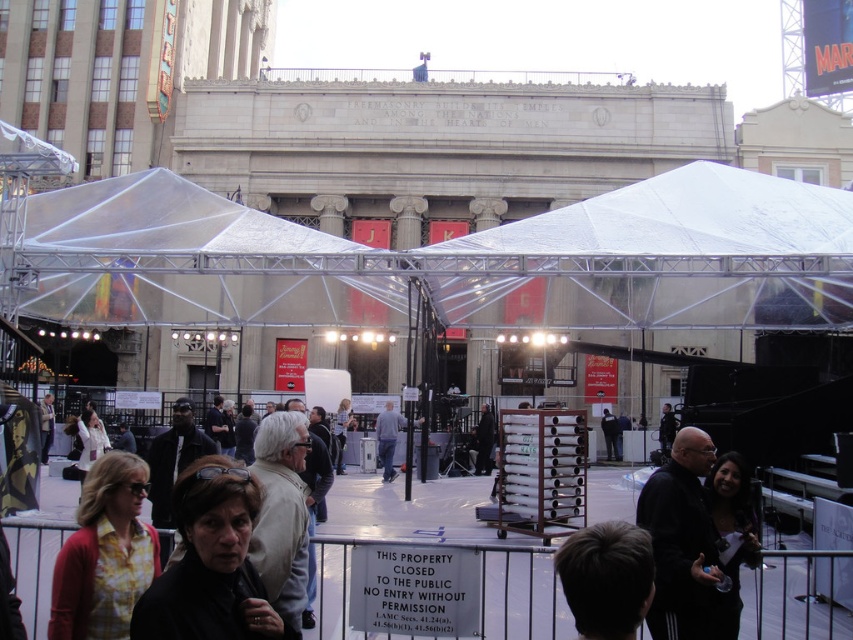
Can you confirm if dark brown hair at center is smaller than black leather jacket at center?

Incorrect, dark brown hair at center is not smaller in size than black leather jacket at center.

How distant is dark brown hair at center from black leather jacket at center?

dark brown hair at center and black leather jacket at center are 119.30 feet apart.

Where is `dark brown hair at center`? dark brown hair at center is located at coordinates (606, 579).

Find the location of a particular element. Image resolution: width=853 pixels, height=640 pixels. dark brown hair at center is located at coordinates (606, 579).

Between point (651, 556) and point (664, 429), which one is positioned in front?

Positioned in front is point (651, 556).

Does dark brown hair at center appear on the left side of dark gray suit at center?

Yes, dark brown hair at center is to the left of dark gray suit at center.

This screenshot has width=853, height=640. What do you see at coordinates (606, 579) in the screenshot?
I see `dark brown hair at center` at bounding box center [606, 579].

Find the location of a particular element. This screenshot has height=640, width=853. dark brown hair at center is located at coordinates (606, 579).

Does black matte jacket at lower right have a smaller size compared to light gray fabric jacket at center?

No.

Locate an element on the screen. The height and width of the screenshot is (640, 853). black matte jacket at lower right is located at coordinates (688, 547).